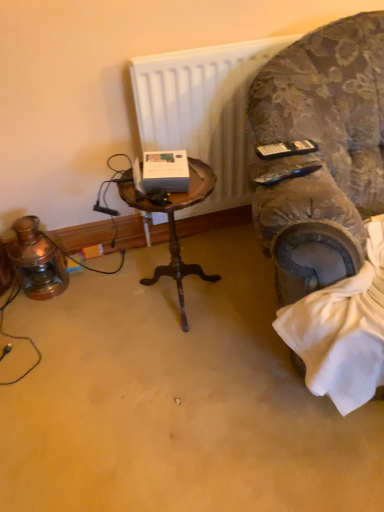
Question: Looking at the image, does velvet-patterned armchair at right seem bigger or smaller compared to woodenobject at center?

Choices:
 (A) big
 (B) small

Answer: (A)

Question: Considering the positions of velvet-patterned armchair at right and woodenobject at center in the image, is velvet-patterned armchair at right wider or thinner than woodenobject at center?

Choices:
 (A) wide
 (B) thin

Answer: (A)

Question: Which object is the farthest from the white matte radiator at upper center?

Choices:
 (A) velvet-patterned armchair at right
 (B) woodenobject at center

Answer: (B)

Question: Estimate the real-world distances between objects in this image. Which object is closer to the woodenobject at center?

Choices:
 (A) white matte radiator at upper center
 (B) velvet-patterned armchair at right

Answer: (A)